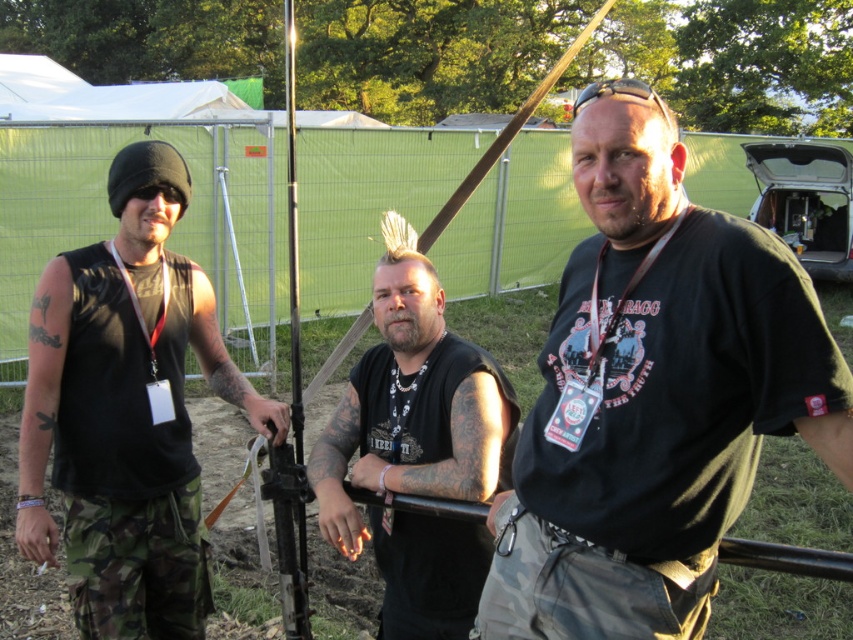
You are a photographer at the event and need to adjust the lighting. You have to decide which person to ask for help based on their height. The person wearing the matte black tank top at left and the one in the black matte vest at center are both available. Which one is taller?

The matte black tank top at left is taller than the black matte vest at center, so you should ask the person in the matte black tank top at left for help.

You are taking a photo and want to focus on both point (171, 148) and point (398, 301) in the image. Which point should you adjust your camera focus to first to ensure both are in focus?

You should adjust your camera focus to point (171, 148) first because it is closer to the camera than point (398, 301). By focusing on the closer point, the further point will also be within the depth of field.